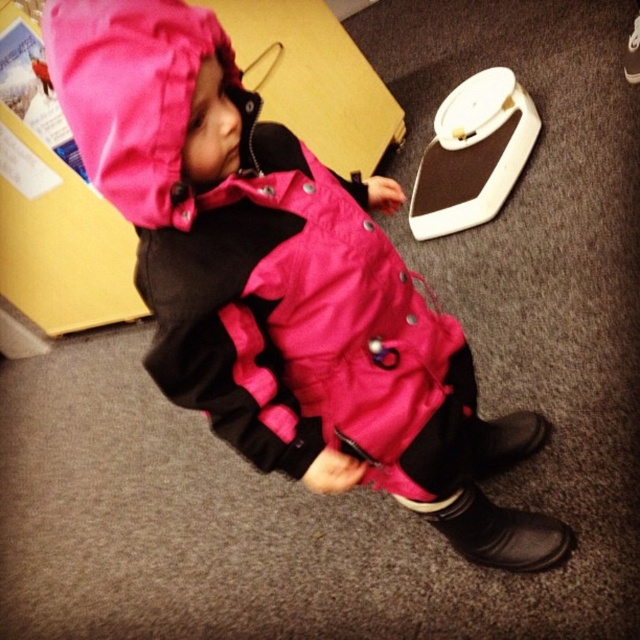
You are a delivery person who needs to place a package on the floor near the matte pink snowsuit at center. The coordinates of the package should be within 0.1 units of the snowsuit. What are the acceptable coordinates for placing the package?

The acceptable coordinates for placing the package must be between 0.342 to 0.542 on the x and 0.339 to 0.539 on the y axis, as the matte pink snowsuit at center is located at point (280, 282).

You are a parent looking to dress your child for a winter activity. You have the matte pink snowsuit at center and the black leather boot at lower right available. Which item should you put on first according to the spatial arrangement in the image?

The matte pink snowsuit at center should be put on first because it is closer to the viewer, indicating it is positioned in front of the black leather boot at lower right, making it more accessible.

You are a photographer positioned in front of the matte pink snowsuit at center. You want to ensure that the snowsuit is in focus while the background remains slightly blurred. Based on the distance provided, what adjustment should you make to the camera lens?

The matte pink snowsuit at center is 23.58 inches away from the camera. To keep the snowsuit in focus and blur the background, adjust the camera lens to a smaller aperture setting, which allows for a shallow depth of field.